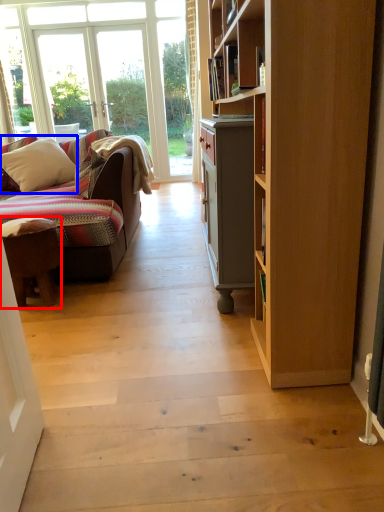
Question: Which point is further to the camera, desk (highlighted by a red box) or pillow (highlighted by a blue box)?

Choices:
 (A) desk
 (B) pillow

Answer: (B)